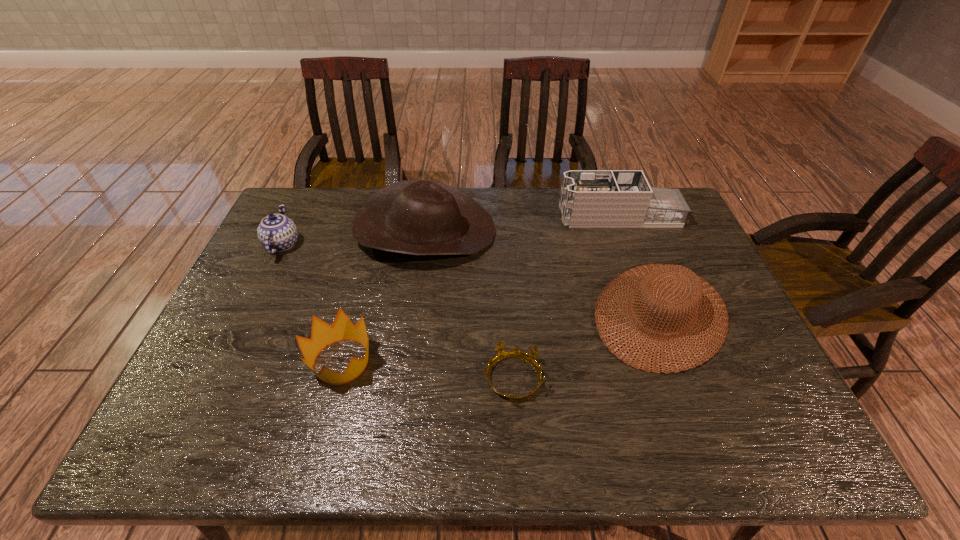
The image size is (960, 540). In order to click on cowboy hat in this screenshot , I will do `click(418, 217)`.

Locate an element on the screen. dollhouse is located at coordinates (589, 198).

You are a GUI agent. You are given a task and a screenshot of the screen. Output one action in this format:
    pyautogui.click(x=<x>, y=<y>)
    Task: Click on the leftmost object
    The image size is (960, 540).
    Given the screenshot: What is the action you would take?
    pyautogui.click(x=276, y=232)

Find the location of a particular element. sunhat is located at coordinates (658, 276).

Locate an element on the screen. the taller crown is located at coordinates (322, 335).

I want to click on the right crown, so click(x=530, y=358).

In order to click on the shorter crown in this screenshot , I will do `click(530, 358)`.

The image size is (960, 540). I want to click on vacant region located 0.270m on the left of the cowboy hat, so click(x=273, y=232).

In order to click on vacant area situated at the entrance of the dollhouse in this screenshot , I will do `click(450, 216)`.

I want to click on vacant space situated at the entrance of the dollhouse, so click(491, 216).